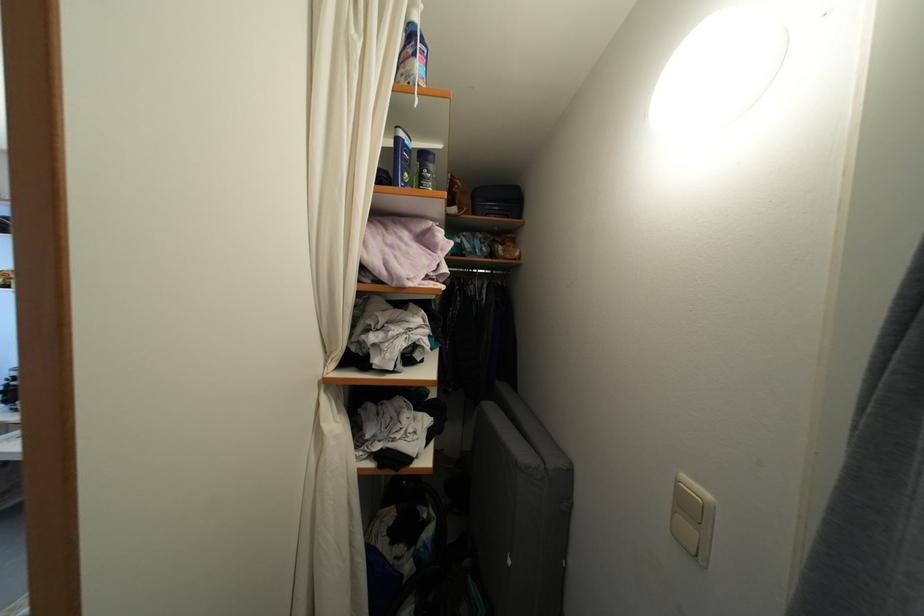
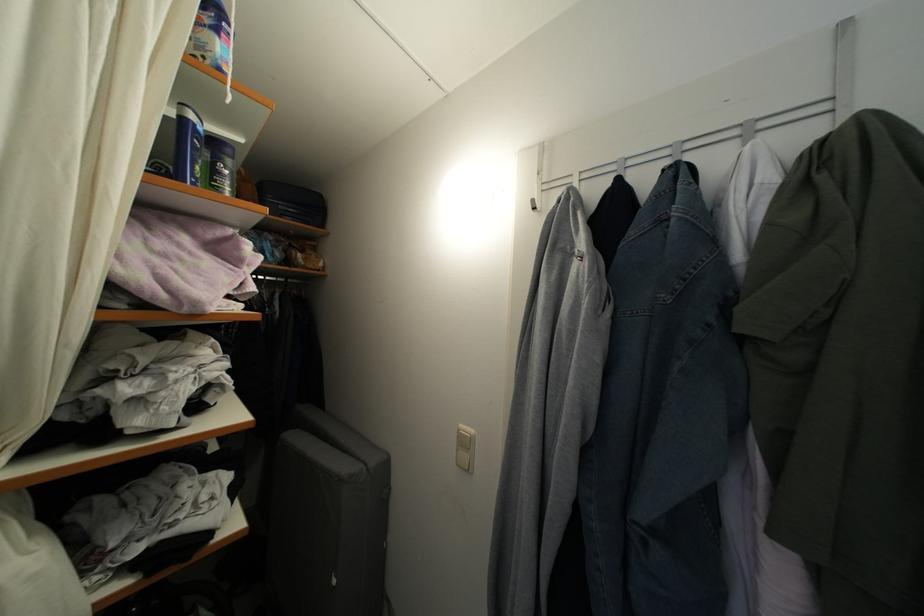
In the second image, find the point that corresponds to the point at 407,140 in the first image.

(198, 122)